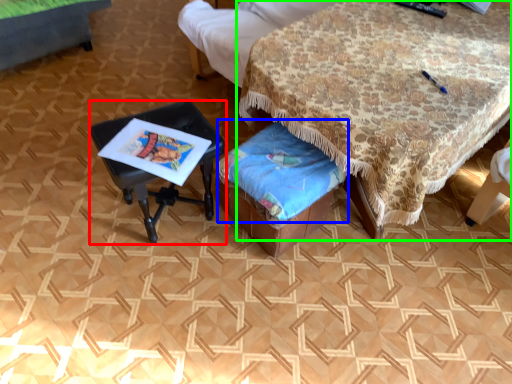
Question: Considering the real-world distances, which object is closest to table (highlighted by a red box)? blanket (highlighted by a blue box) or table (highlighted by a green box).

Choices:
 (A) blanket
 (B) table

Answer: (A)